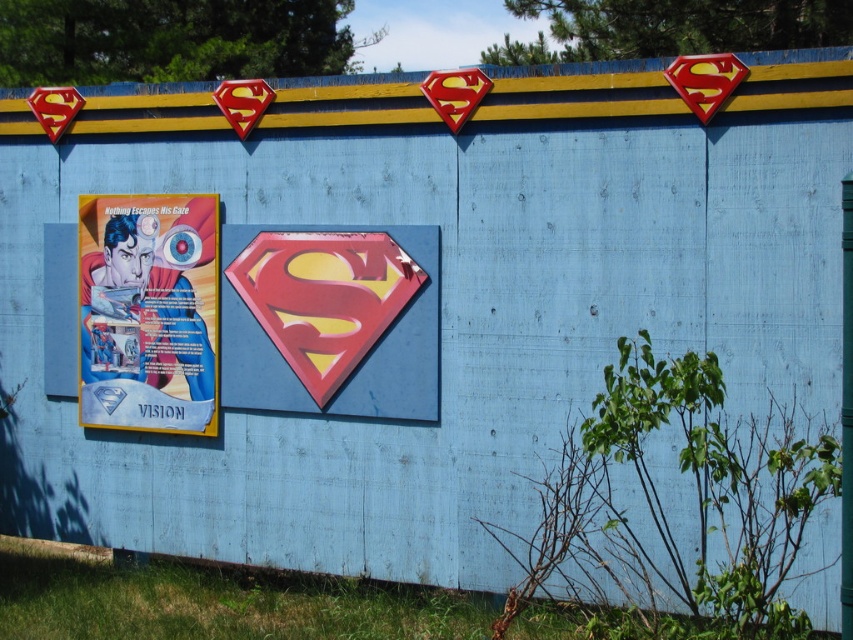
You are a customer in a comic shop and see the metallic silver comic book at center and the matte paper poster at left. Which item is positioned lower in the scene?

The metallic silver comic book at center is located below the matte paper poster at left, so it is positioned lower in the scene.

You are organizing a Superman exhibit and need to place the metallic silver comic book at center and the matte paper poster at left on a display stand. The stand has a width limit of 1 meter. If the poster is 0.6 meters wide, will the comic book fit on the same stand without overlapping?

The metallic silver comic book at center is wider than the matte paper poster at left, which is 0.6 meters wide. Since the stand has a 1 meter width limit, the comic book would exceed the available space if placed alongside the poster. Therefore, it cannot fit without overlapping.